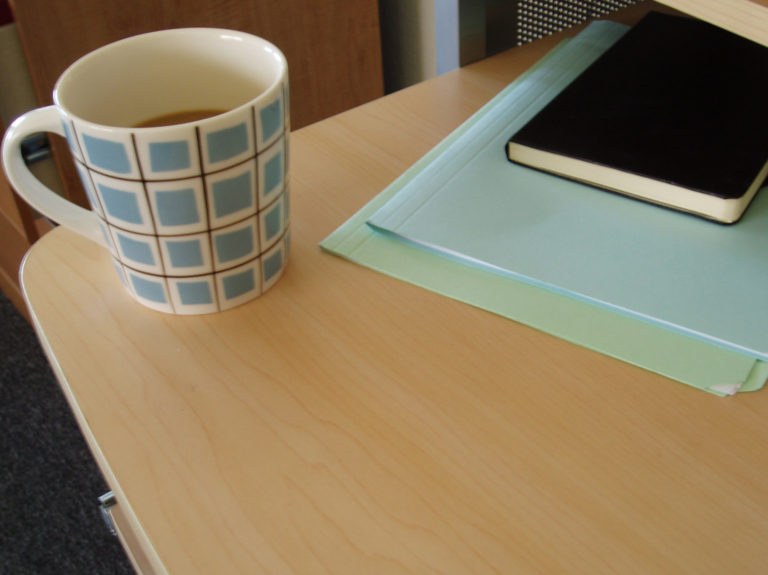
This screenshot has width=768, height=575. What are the coordinates of `coffe cup` in the screenshot? It's located at (219, 236).